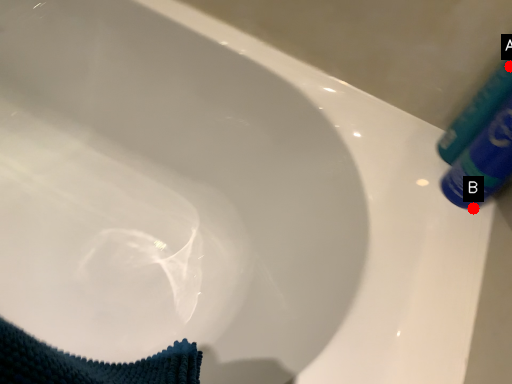
Question: Two points are circled on the image, labeled by A and B beside each circle. Which point appears closest to the camera in this image?

Choices:
 (A) A is closer
 (B) B is closer

Answer: (A)